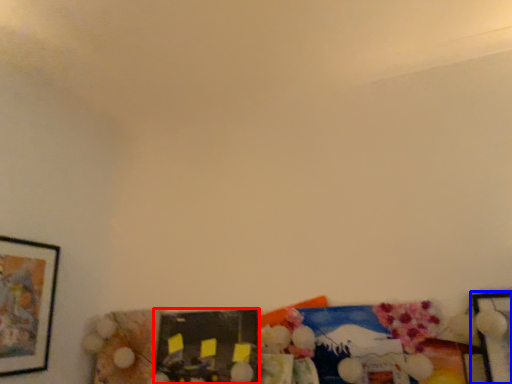
Question: Which point is further to the camera, picture frame (highlighted by a red box) or picture frame (highlighted by a blue box)?

Choices:
 (A) picture frame
 (B) picture frame

Answer: (A)